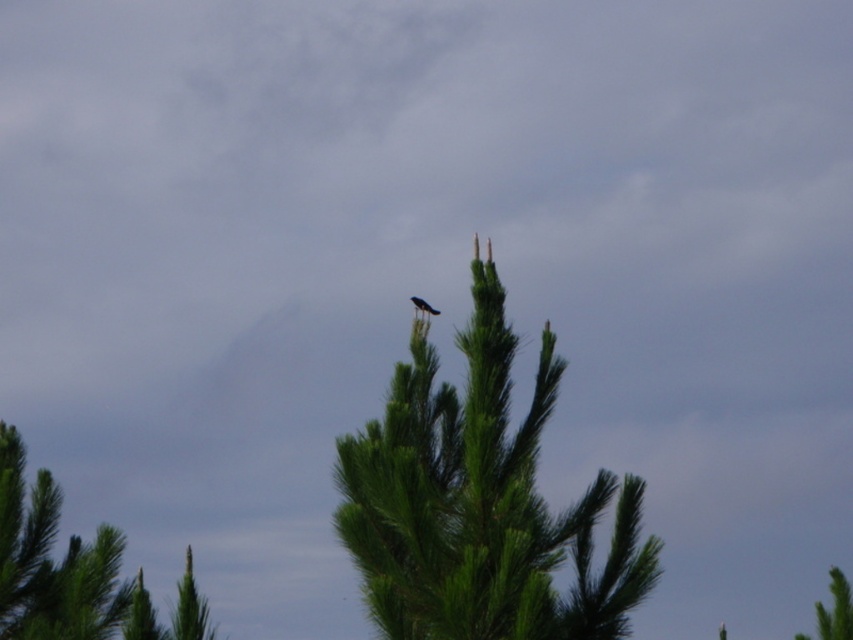
Which is below, green needle-like tree at center or shiny black bird at center?

green needle-like tree at center is lower down.

Between green needle-like tree at center and shiny black bird at center, which one has more height?

green needle-like tree at center

Measure the distance between point (413, 420) and camera.

Point (413, 420) and camera are 14.86 meters apart.

Identify the location of green needle-like tree at center. (479, 502).